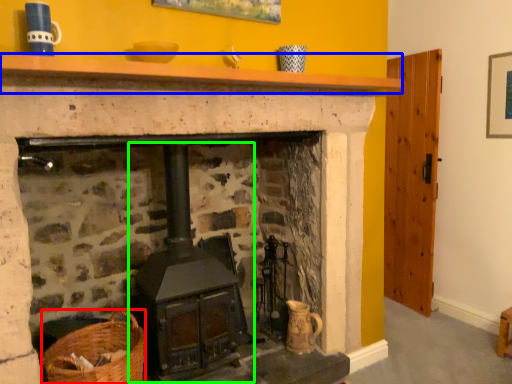
Question: Based on their relative distances, which object is farther from basket (highlighted by a red box)? Choose from mantle (highlighted by a blue box) and stove (highlighted by a green box).

Choices:
 (A) mantle
 (B) stove

Answer: (A)